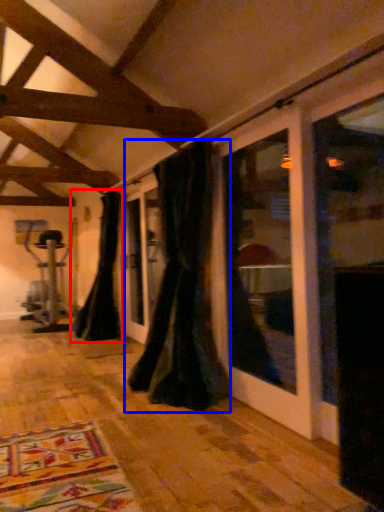
Question: Which of the following is the closest to the observer, curtain (highlighted by a red box) or curtain (highlighted by a blue box)?

Choices:
 (A) curtain
 (B) curtain

Answer: (B)